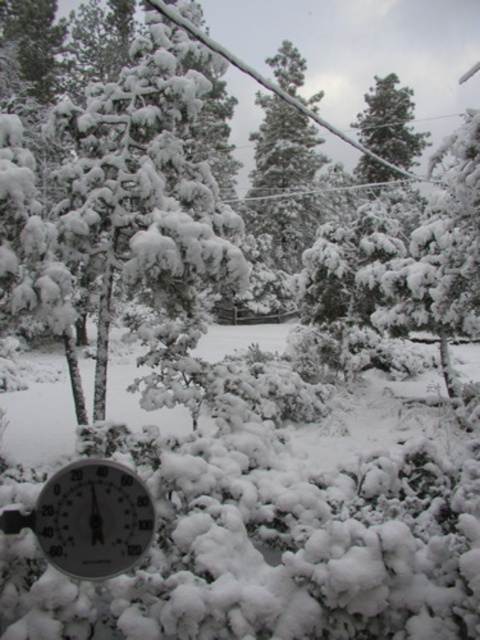
Who is taller, transparent glass thermometer at lower left or snow-covered evergreen tree at center?

With more height is snow-covered evergreen tree at center.

Can you confirm if transparent glass thermometer at lower left is shorter than snow-covered evergreen tree at center?

Correct, transparent glass thermometer at lower left is not as tall as snow-covered evergreen tree at center.

Identify the location of transparent glass thermometer at lower left. (94, 518).